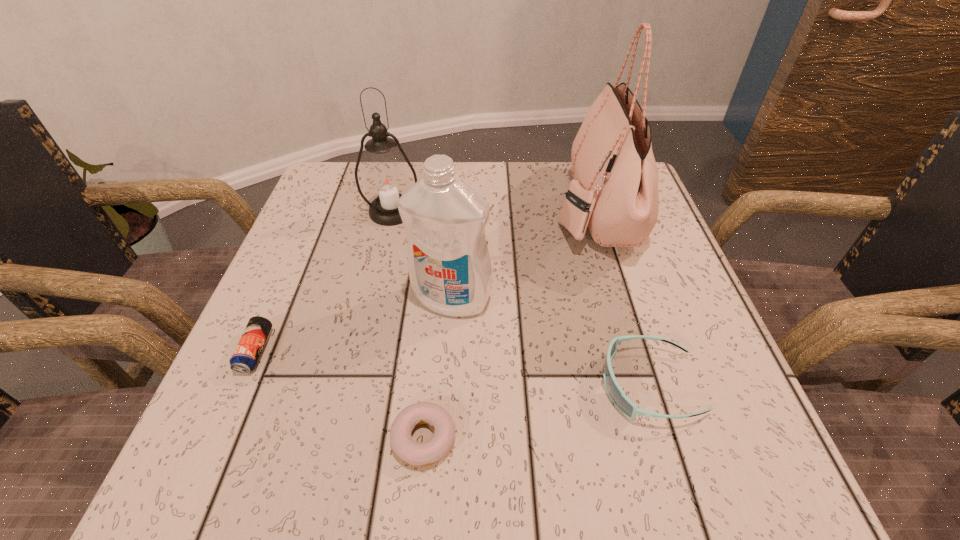
The height and width of the screenshot is (540, 960). Identify the location of the tallest object. pos(614,191).

Where is `detergent`? detergent is located at coordinates (449, 265).

This screenshot has width=960, height=540. Identify the location of the second object from left to right. (386, 180).

You are a GUI agent. You are given a task and a screenshot of the screen. Output one action in this format:
    pyautogui.click(x=<x>, y=<y>)
    Task: Click on the fourth tallest object
    This screenshot has height=540, width=960.
    Given the screenshot: What is the action you would take?
    pyautogui.click(x=623, y=403)

Where is `the second shortest object`? the second shortest object is located at coordinates (244, 359).

What are the coordinates of `the leftmost object` in the screenshot? It's located at (244, 359).

The width and height of the screenshot is (960, 540). Find the location of `doughnut`. doughnut is located at coordinates (414, 453).

Locate an element on the screen. free space located 0.340m on the side of the tallest object with the attached pouch is located at coordinates [x=408, y=208].

The height and width of the screenshot is (540, 960). I want to click on free region located on the side of the tallest object with the attached pouch, so click(x=429, y=208).

The width and height of the screenshot is (960, 540). I want to click on free space located 0.300m on the side of the tallest object with the attached pouch, so click(425, 208).